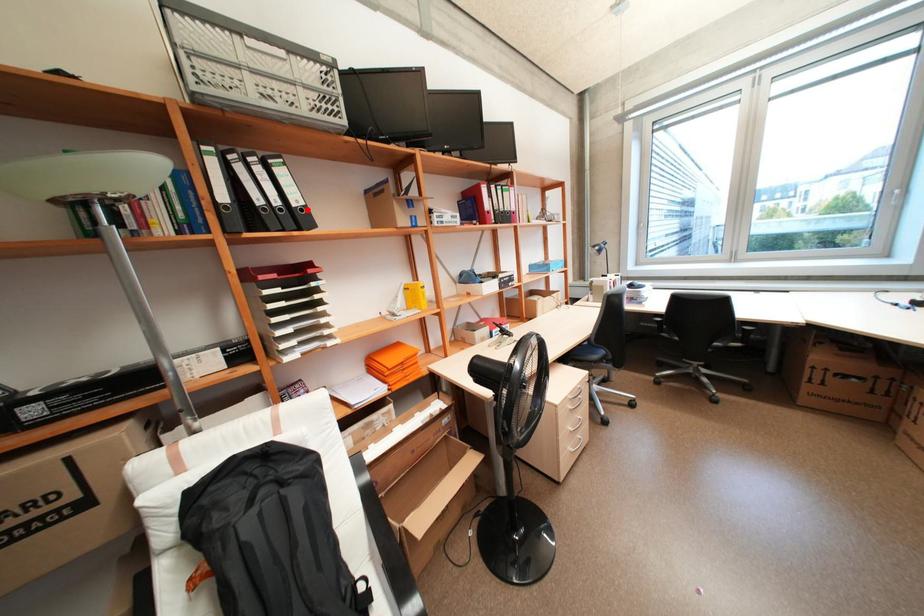
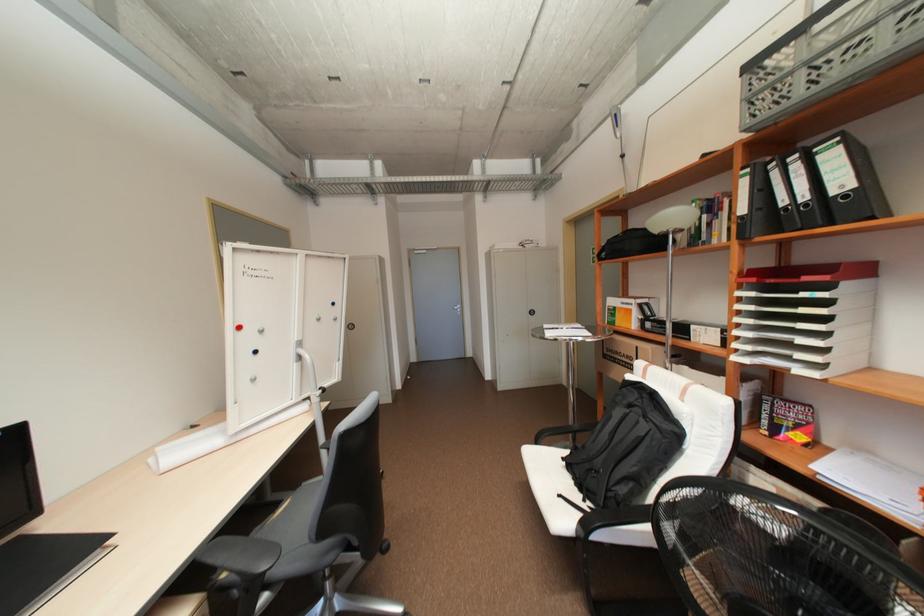
Locate, in the second image, the point that corresponds to the highlighted location in the first image.

(852, 197)